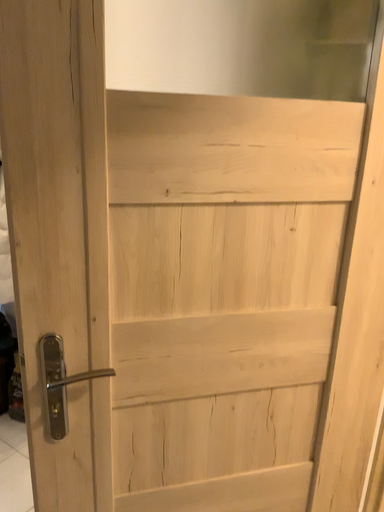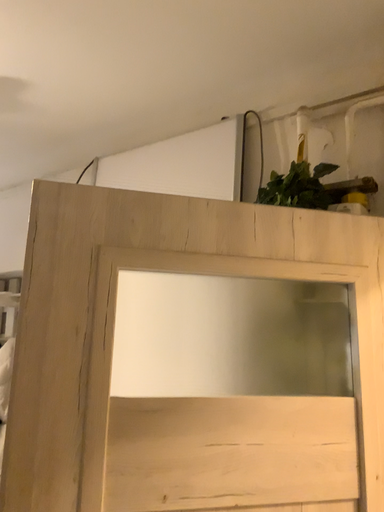
Question: How did the camera likely rotate when shooting the video?

Choices:
 (A) rotated upward
 (B) rotated downward

Answer: (A)